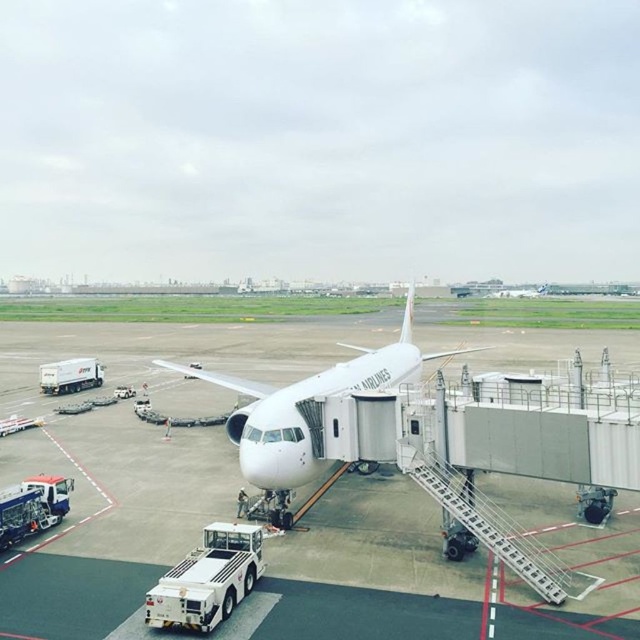
Is white smooth tarmac at center shorter than white glossy airplane at center?

Correct, white smooth tarmac at center is not as tall as white glossy airplane at center.

What do you see at coordinates (147, 426) in the screenshot? The width and height of the screenshot is (640, 640). I see `white smooth tarmac at center` at bounding box center [147, 426].

Which is in front, point (208, 477) or point (376, 381)?

Point (208, 477) is more forward.

Find the location of a particular element. This screenshot has height=640, width=640. white smooth tarmac at center is located at coordinates (147, 426).